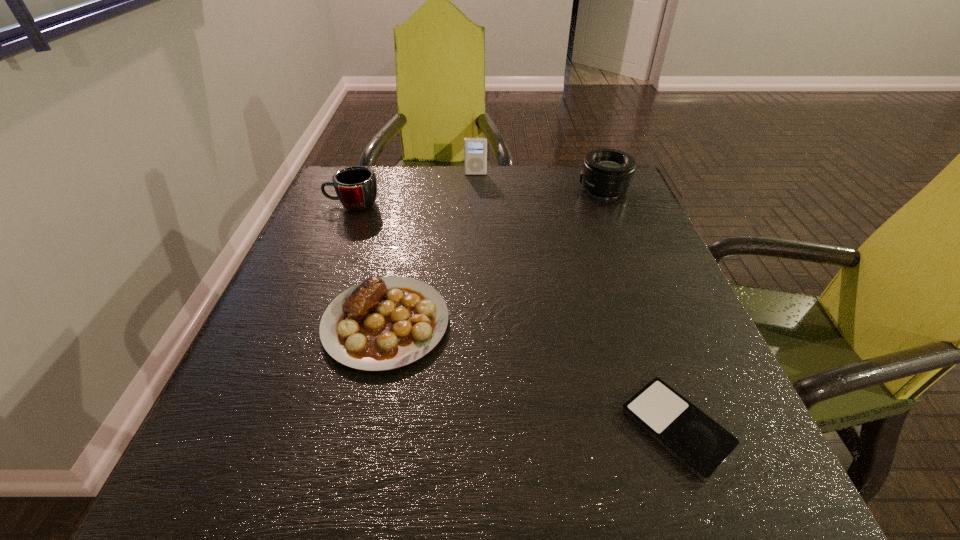
Select which object appears as the closest to the right iPod. Please provide its 2D coordinates. Your answer should be formatted as a tuple, i.e. [(x, y)], where the tuple contains the x and y coordinates of a point satisfying the conditions above.

[(383, 323)]

Select which object appears as the closest to the mug. Please provide its 2D coordinates. Your answer should be formatted as a tuple, i.e. [(x, y)], where the tuple contains the x and y coordinates of a point satisfying the conditions above.

[(475, 149)]

In order to click on vacant space that satisfies the following two spatial constraints: 1. on the side of the mug with the handle; 2. on the right side of the steak in this screenshot , I will do `click(306, 323)`.

Identify the location of free point that satisfies the following two spatial constraints: 1. on the side of the right iPod with the handle; 2. on the left side of the mug. (265, 428).

Find the location of a particular element. Image resolution: width=960 pixels, height=540 pixels. free space that satisfies the following two spatial constraints: 1. on the front-facing side of the third object from right to left; 2. on the side of the mug with the handle is located at coordinates (x=475, y=204).

The height and width of the screenshot is (540, 960). Identify the location of vacant region that satisfies the following two spatial constraints: 1. on the side of the telephoto lens with brand markings and control switches; 2. on the front side of the shortest object. (699, 428).

You are a GUI agent. You are given a task and a screenshot of the screen. Output one action in this format:
    pyautogui.click(x=<x>, y=<y>)
    Task: Click on the vacant space that satisfies the following two spatial constraints: 1. on the front-facing side of the left iPod; 2. on the side of the mug with the handle
    
    Given the screenshot: What is the action you would take?
    pyautogui.click(x=475, y=204)

This screenshot has width=960, height=540. In order to click on free space that satisfies the following two spatial constraints: 1. on the front-facing side of the nearer iPod; 2. on the left side of the tallest object in this screenshot , I will do `click(472, 428)`.

This screenshot has width=960, height=540. I want to click on blank space that satisfies the following two spatial constraints: 1. on the side of the mug with the handle; 2. on the left side of the second shortest object, so click(306, 323).